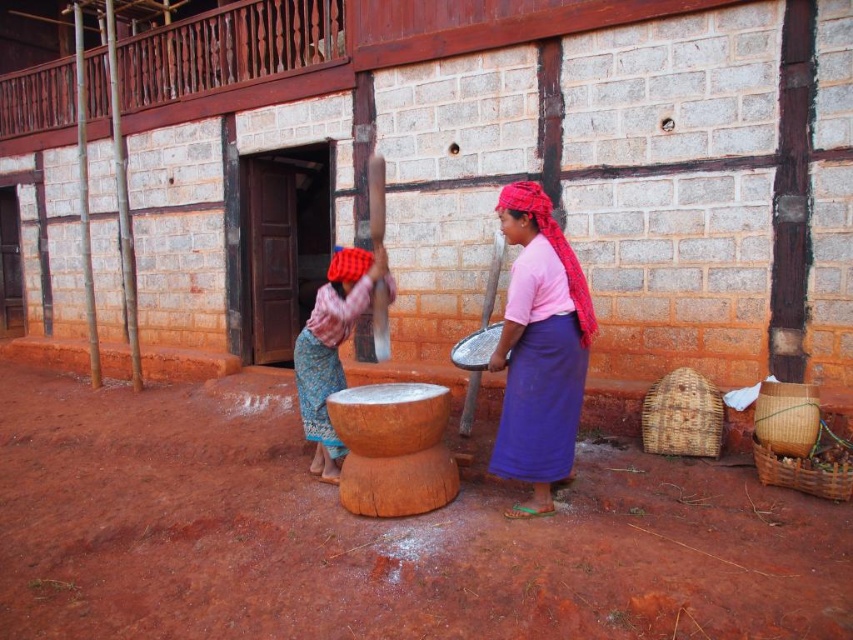
Question: Among these points, which one is nearest to the camera?

Choices:
 (A) (329, 422)
 (B) (560, 458)

Answer: (B)

Question: Does pink fabric skirt at center appear on the left side of matte pink fabric at center?

Choices:
 (A) no
 (B) yes

Answer: (A)

Question: Can you confirm if pink fabric skirt at center is bigger than matte pink fabric at center?

Choices:
 (A) no
 (B) yes

Answer: (A)

Question: Which of the following is the farthest from the observer?

Choices:
 (A) pink fabric skirt at center
 (B) matte pink fabric at center

Answer: (B)

Question: From the image, what is the correct spatial relationship of pink fabric skirt at center in relation to matte pink fabric at center?

Choices:
 (A) right
 (B) left

Answer: (A)